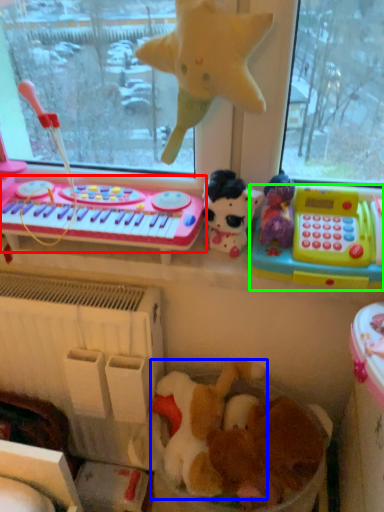
Question: Based on their relative distances, which object is nearer to musical keyboard (highlighted by a red box)? Choose from toy (highlighted by a blue box) and toy (highlighted by a green box).

Choices:
 (A) toy
 (B) toy

Answer: (B)